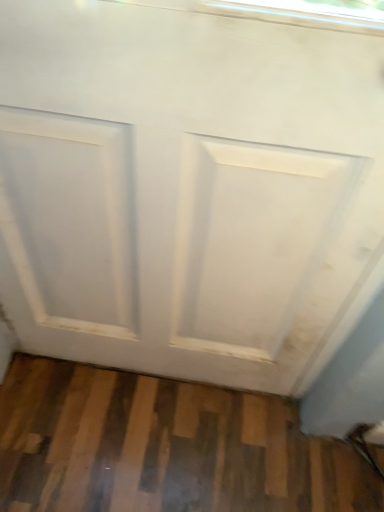
Identify the location of vacant space situated above natural wood floor at lower center (from a real-world perspective). This screenshot has height=512, width=384. (172, 435).